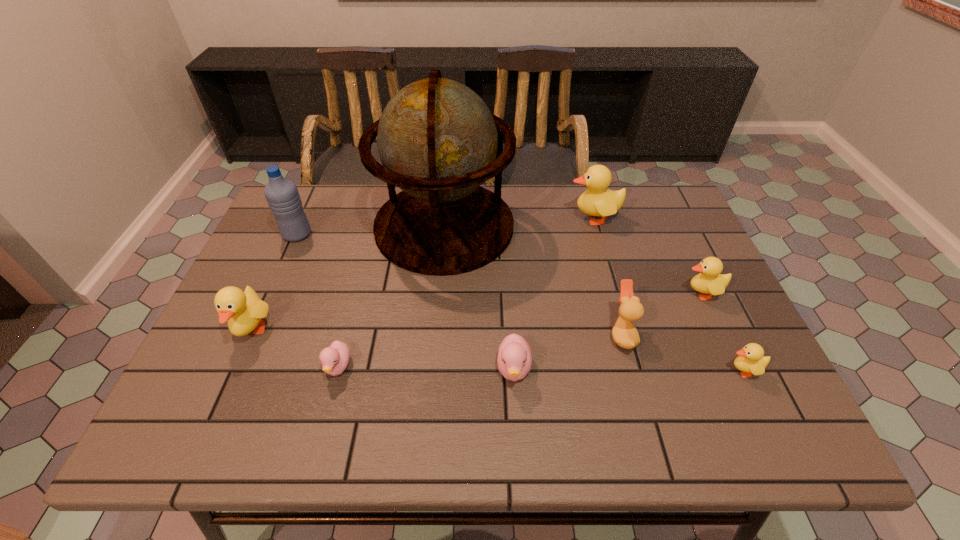
You are a GUI agent. You are given a task and a screenshot of the screen. Output one action in this format:
    pyautogui.click(x=<x>, y=<y>)
    Task: Click on the free space located on the front-facing side of the second tallest duckling
    Image resolution: width=960 pixels, height=540 pixels.
    Given the screenshot: What is the action you would take?
    pyautogui.click(x=204, y=439)

This screenshot has width=960, height=540. What are the coordinates of `free point located 0.220m on the beak of the duck` in the screenshot? It's located at pos(516,335).

What are the coordinates of `free location located on the beak of the duck` in the screenshot? It's located at (494, 335).

Find the location of `vacant space located on the beak of the duck`. vacant space located on the beak of the duck is located at coordinates (512, 335).

This screenshot has height=540, width=960. Identify the location of vacant space situated 0.260m on the front-facing side of the second farthest yellow duckling. (579, 293).

At what (x,y) coordinates should I click in order to perform the action: click on free space located on the front-facing side of the second farthest yellow duckling. Please return your answer as a coordinate pair (x, y). Looking at the image, I should click on (641, 293).

This screenshot has height=540, width=960. I want to click on vacant point located on the front-facing side of the second farthest yellow duckling, so click(x=548, y=293).

Where is `vacant space located 0.060m on the front-facing side of the bigger pink duckling`? This screenshot has width=960, height=540. vacant space located 0.060m on the front-facing side of the bigger pink duckling is located at coordinates click(517, 421).

Locate an element on the screen. vacant region located on the front-facing side of the nearest yellow duckling is located at coordinates (612, 371).

Find the location of `free space located on the front-facing side of the nearest yellow duckling`. free space located on the front-facing side of the nearest yellow duckling is located at coordinates (652, 371).